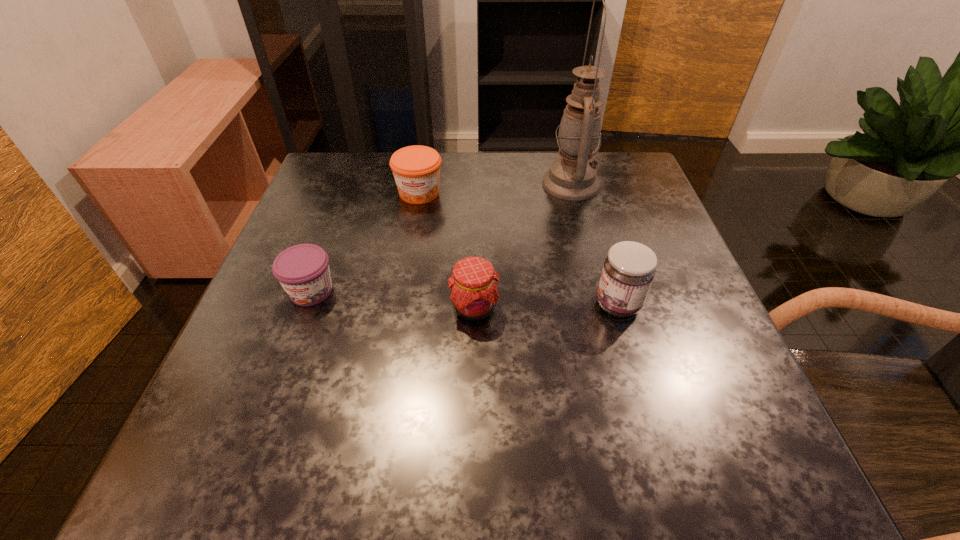
Select which jam is the fourth closest to the tallest object. Please provide its 2D coordinates. Your answer should be formatted as a tuple, i.e. [(x, y)], where the tuple contains the x and y coordinates of a point satisfying the conditions above.

[(303, 271)]

Locate an element on the screen. The height and width of the screenshot is (540, 960). free location that satisfies the following two spatial constraints: 1. on the front label of the second jam from left to right; 2. on the left side of the third object from left to right is located at coordinates (399, 308).

You are a GUI agent. You are given a task and a screenshot of the screen. Output one action in this format:
    pyautogui.click(x=<x>, y=<y>)
    Task: Click on the blank space that satisfies the following two spatial constraints: 1. on the front label of the second jam from right to left; 2. on the right side of the leftmost object
    Image resolution: width=960 pixels, height=540 pixels.
    Given the screenshot: What is the action you would take?
    pyautogui.click(x=305, y=308)